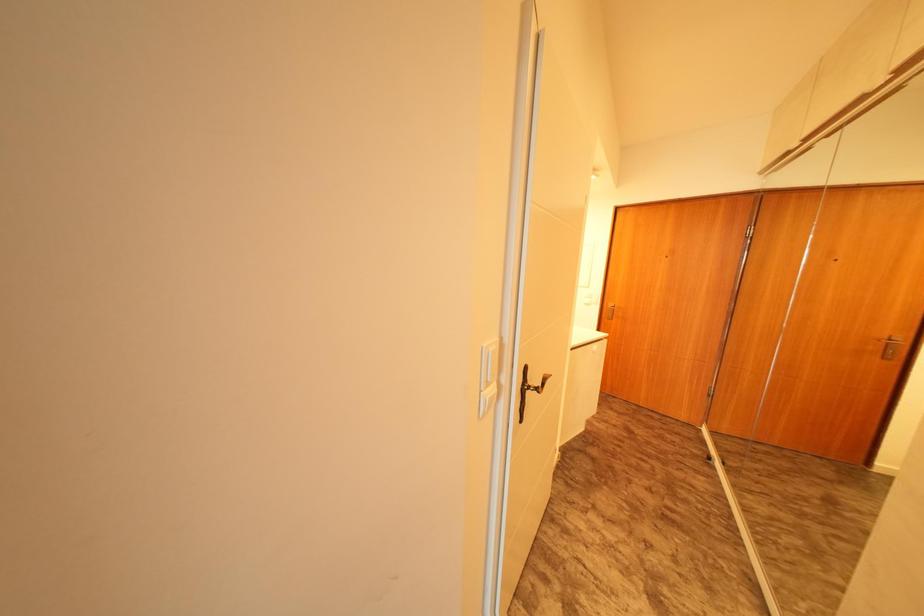
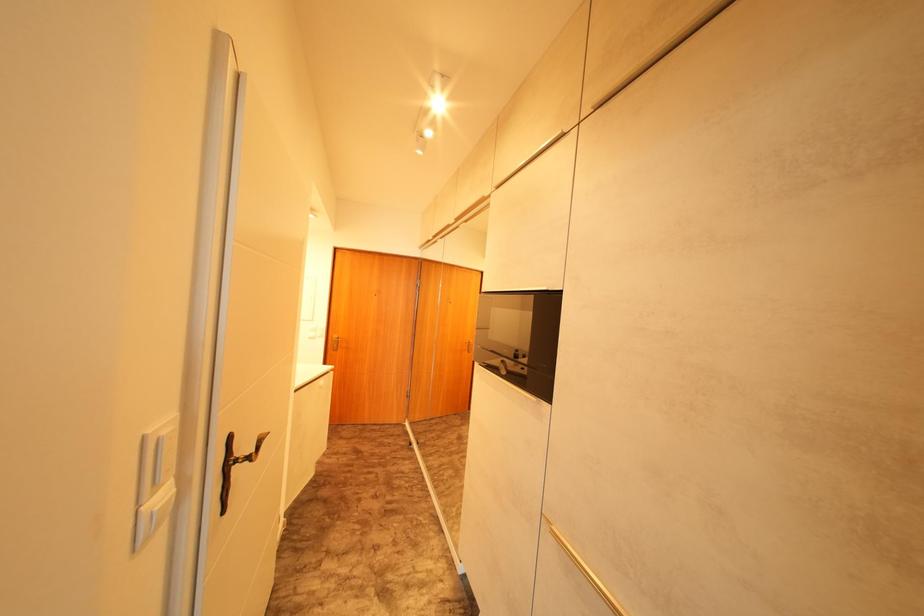
Question: Based on the continuous images, in which direction is the camera rotating? Reply with the corresponding letter.

Choices:
 (A) Left
 (B) Right
 (C) Up
 (D) Down

Answer: (B)